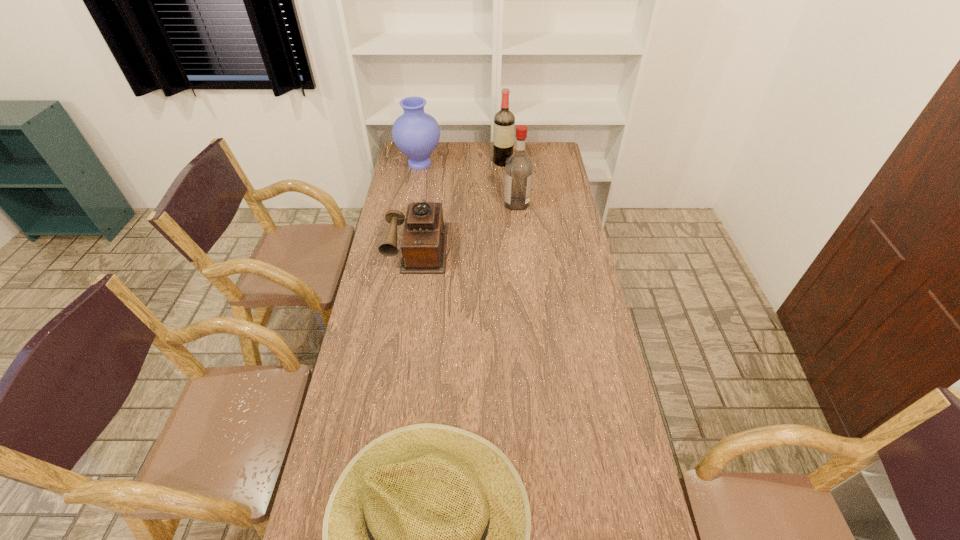
Locate an element on the screen. The height and width of the screenshot is (540, 960). the second closest object to the nearer liquor is located at coordinates (424, 241).

I want to click on object that stands as the closest to the vase, so (x=504, y=121).

The width and height of the screenshot is (960, 540). I want to click on free location that satisfies the following two spatial constraints: 1. on the front-facing side of the nearer liquor; 2. on the horn of the second nearest object, so click(x=520, y=246).